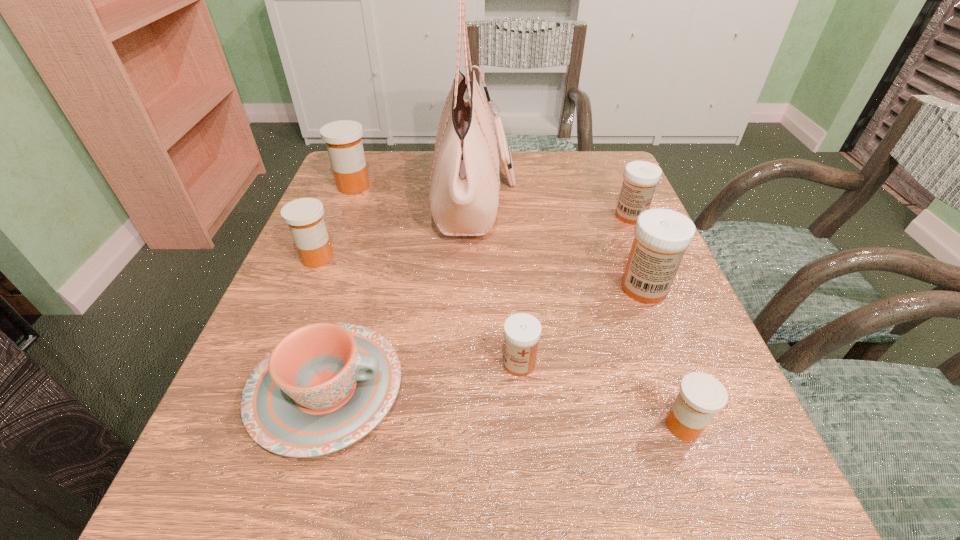
The width and height of the screenshot is (960, 540). Find the location of `vacant space located 0.200m on the label of the smallest orange medicine`. vacant space located 0.200m on the label of the smallest orange medicine is located at coordinates (524, 426).

This screenshot has width=960, height=540. Identify the location of free spot located 0.140m on the label of the smallest orange medicine. (565, 426).

This screenshot has width=960, height=540. Find the location of `free region located on the label of the smallest orange medicine`. free region located on the label of the smallest orange medicine is located at coordinates tap(461, 426).

Image resolution: width=960 pixels, height=540 pixels. What are the coordinates of `blank space located on the handle side of the pink chinaware` in the screenshot? It's located at (552, 389).

The image size is (960, 540). Find the location of `handbag located at the far edge`. handbag located at the far edge is located at coordinates (464, 183).

You are a GUI agent. You are given a task and a screenshot of the screen. Output one action in this format:
    pyautogui.click(x=<x>, y=<y>)
    Task: Click on the medicine at the far edge
    The height and width of the screenshot is (540, 960).
    Given the screenshot: What is the action you would take?
    pyautogui.click(x=343, y=140)

I want to click on chinaware positioned at the left edge, so click(x=324, y=386).

You are a GUI agent. You are given a task and a screenshot of the screen. Output one action in this format:
    pyautogui.click(x=<x>, y=<y>)
    Task: Click on the object present at the far left corner
    
    Given the screenshot: What is the action you would take?
    pyautogui.click(x=343, y=140)

In the image, there is a desktop. Where is `blank space at the far edge`? This screenshot has width=960, height=540. blank space at the far edge is located at coordinates (521, 151).

In order to click on vacant space at the near edge of the desktop in this screenshot , I will do `click(656, 525)`.